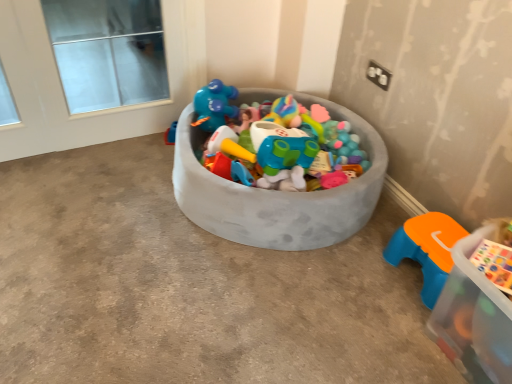
Question: From the image's perspective, is white glass window at upper left positioned above or below textured gray bowl at center, the first storage box from the left?

Choices:
 (A) above
 (B) below

Answer: (A)

Question: Considering the positions of white glass window at upper left and textured gray bowl at center, the second storage box viewed from the right, in the image, is white glass window at upper left wider or thinner than textured gray bowl at center, the second storage box viewed from the right,?

Choices:
 (A) thin
 (B) wide

Answer: (A)

Question: Estimate the real-world distances between objects in this image. Which object is farther from the transparent plastic storage box at lower right, which ranks as the 1th storage box in front-to-back order?

Choices:
 (A) textured gray bowl at center, the second storage box viewed from the right
 (B) orange plastic stool at lower right
 (C) white glass window at upper left

Answer: (C)

Question: Which of these objects is positioned closest to the orange plastic stool at lower right?

Choices:
 (A) white glass window at upper left
 (B) textured gray bowl at center, the second storage box viewed from the right
 (C) transparent plastic storage box at lower right, positioned as the second storage box in back-to-front order

Answer: (C)